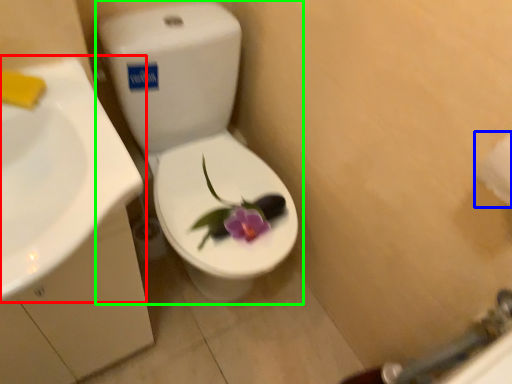
Question: Which object is the closest to the sink (highlighted by a red box)? Choose among these: toilet paper (highlighted by a blue box) or toilet (highlighted by a green box).

Choices:
 (A) toilet paper
 (B) toilet

Answer: (B)